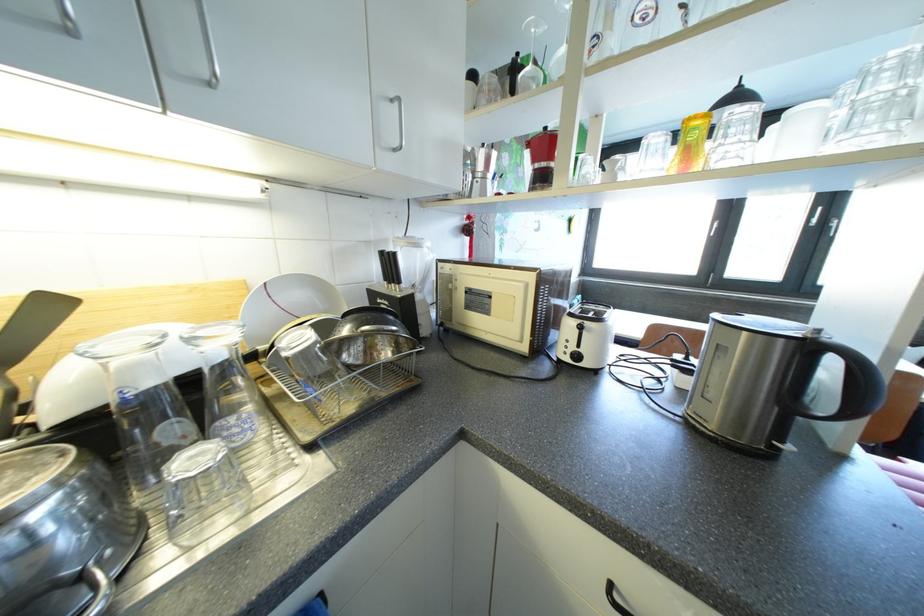
Image resolution: width=924 pixels, height=616 pixels. What do you see at coordinates (103, 599) in the screenshot? I see `the metal pot handle` at bounding box center [103, 599].